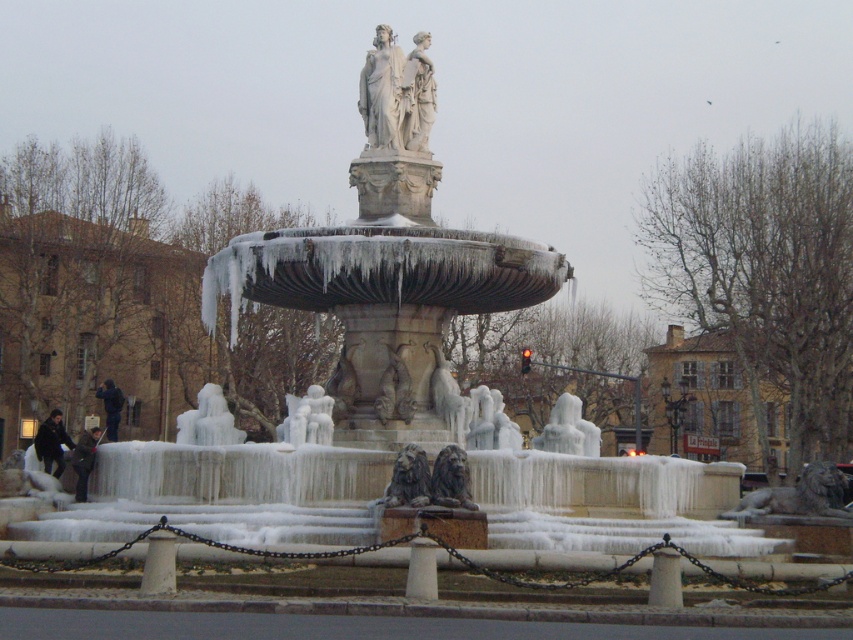
Question: Which point is farther to the camera?

Choices:
 (A) (399, 465)
 (B) (398, 344)

Answer: (B)

Question: Does white marble statues at center have a larger size compared to carved stone lion at center?

Choices:
 (A) yes
 (B) no

Answer: (A)

Question: Is white marble statues at center closer to the viewer compared to dark brown stone lion at center?

Choices:
 (A) no
 (B) yes

Answer: (A)

Question: Which object appears farthest from the camera in this image?

Choices:
 (A) white marble statues at center
 (B) dark brown stone lion at center

Answer: (A)

Question: Does dark brown stone lion at center have a lesser width compared to carved stone lion at center?

Choices:
 (A) no
 (B) yes

Answer: (A)

Question: Which of the following is the farthest from the observer?

Choices:
 (A) dark brown stone lion at center
 (B) white marble statues at center
 (C) carved stone lion at center

Answer: (B)